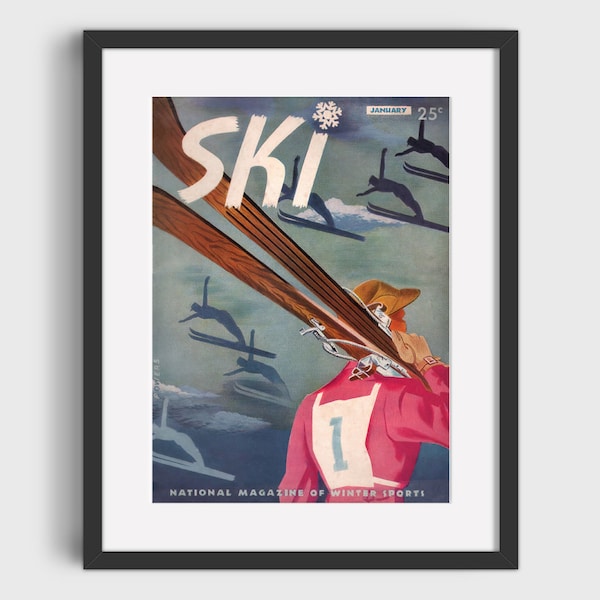
What are the coordinates of `wall` in the screenshot? It's located at (567, 354).